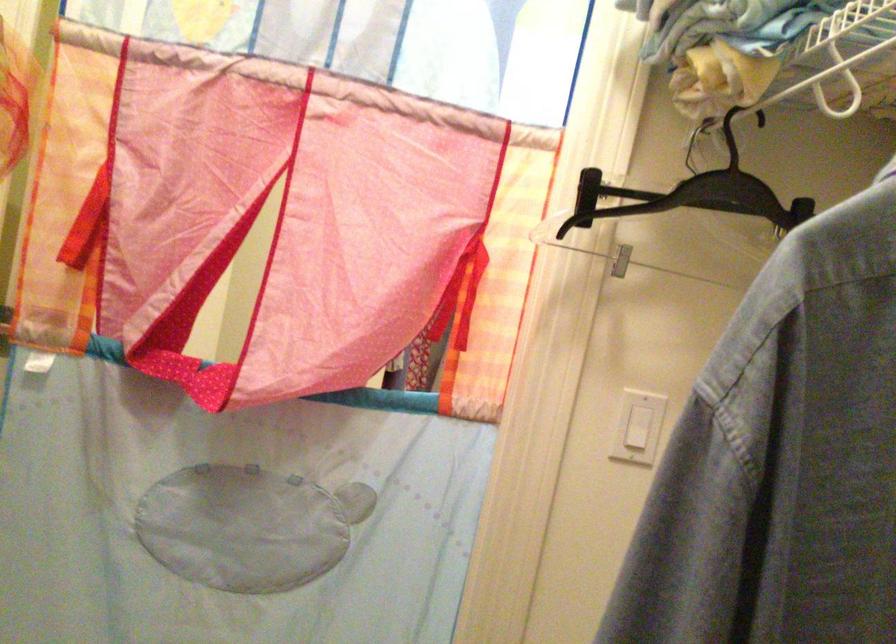
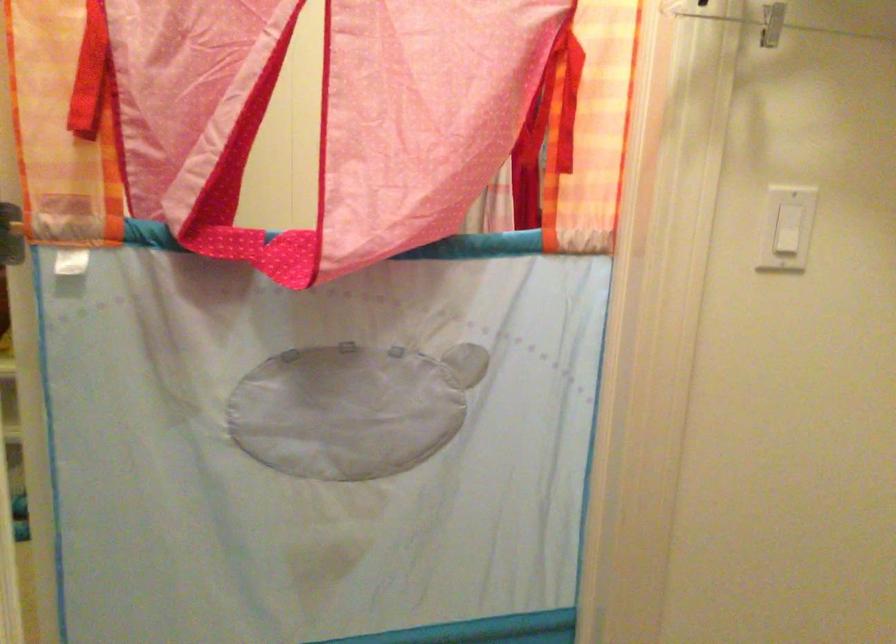
Find the pixel in the second image that matches (x=245, y=524) in the first image.

(351, 408)